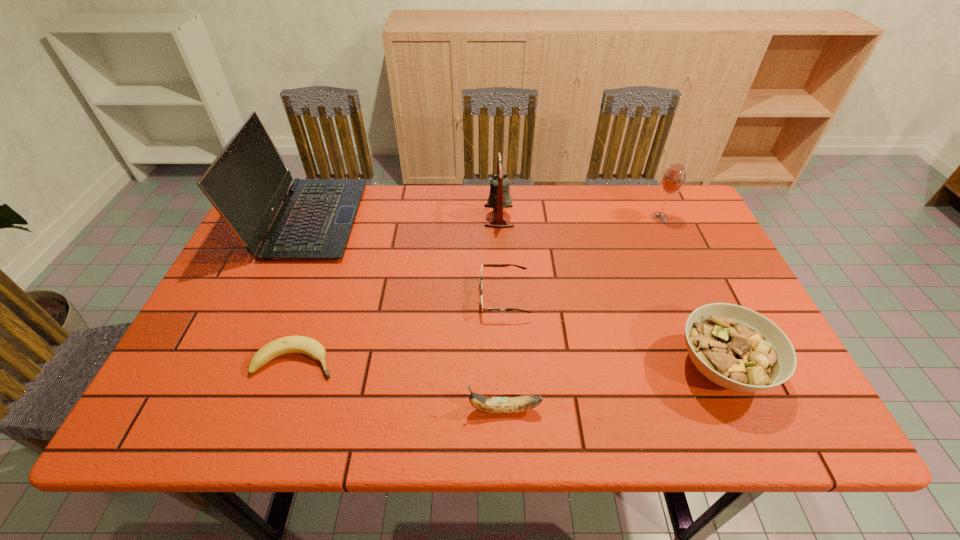
In order to click on free spot that satisfies the following two spatial constraints: 1. on the screen of the tallest object; 2. on the right side of the stew in this screenshot , I will do `click(246, 367)`.

This screenshot has height=540, width=960. What are the coordinates of `vacant region that satisfies the following two spatial constraints: 1. on the frame of the fourth nearest object; 2. on the right side of the stew` in the screenshot? It's located at point(508,367).

The image size is (960, 540). I want to click on vacant region that satisfies the following two spatial constraints: 1. on the front side of the bell; 2. on the left side of the stew, so click(x=506, y=367).